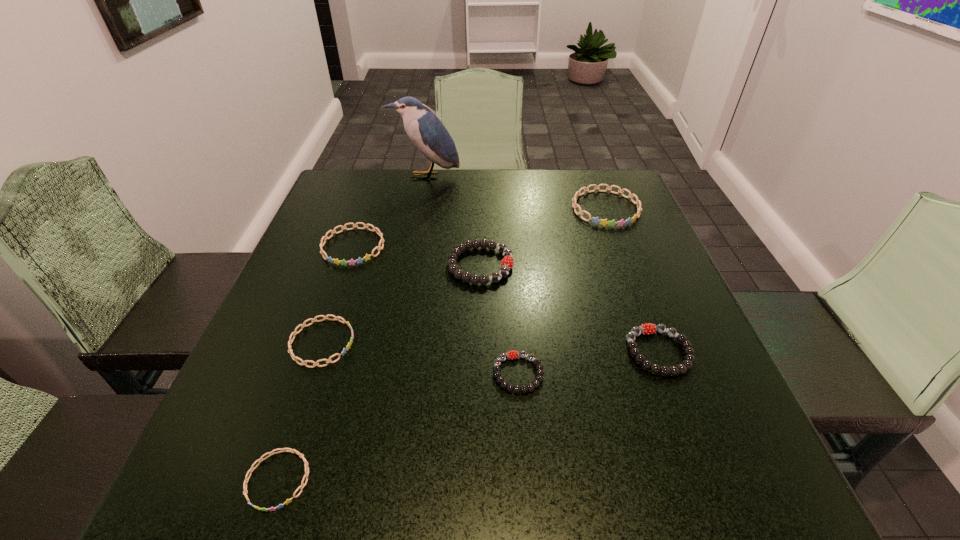
Identify which bracelet is located as the nearest to the third smallest blue bracelet. Please provide its 2D coordinates. Your answer should be formatted as a tuple, i.e. [(x, y)], where the tuple contains the x and y coordinates of a point satisfying the conditions above.

[(507, 262)]

Choose which blue bracelet is the third nearest neighbor to the rightmost black bracelet. Please provide its 2D coordinates. Your answer should be formatted as a tuple, i.e. [(x, y)], where the tuple contains the x and y coordinates of a point satisfying the conditions above.

[(351, 262)]

Where is `blue bracelet that can be found as the closest to the smallest black bracelet`? The width and height of the screenshot is (960, 540). blue bracelet that can be found as the closest to the smallest black bracelet is located at coordinates (303, 325).

Identify which black bracelet is the second nearest to the third smallest blue bracelet. Please provide its 2D coordinates. Your answer should be formatted as a tuple, i.e. [(x, y)], where the tuple contains the x and y coordinates of a point satisfying the conditions above.

[(513, 354)]

Point out which black bracelet is positioned as the second nearest to the rightmost blue bracelet. Please provide its 2D coordinates. Your answer should be formatted as a tuple, i.e. [(x, y)], where the tuple contains the x and y coordinates of a point satisfying the conditions above.

[(649, 328)]

In order to click on vacant space that satisfies the following two spatial constraints: 1. at the tip of the farthest black bracelet's beak; 2. on the right side of the farthest object in this screenshot , I will do `click(409, 265)`.

Where is `vacant space that satisfies the following two spatial constraints: 1. at the tip of the farthest object's beak; 2. on the right side of the smallest black bracelet`? vacant space that satisfies the following two spatial constraints: 1. at the tip of the farthest object's beak; 2. on the right side of the smallest black bracelet is located at coordinates (390, 374).